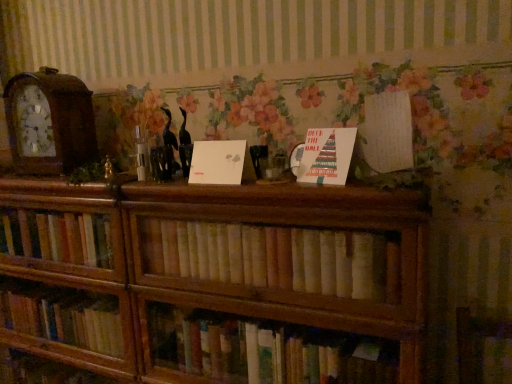
Find the location of a particular element. This screenshot has height=384, width=512. free spot to the left of white paper at center, positioned as the 2th paperback book in right-to-left order is located at coordinates (271, 186).